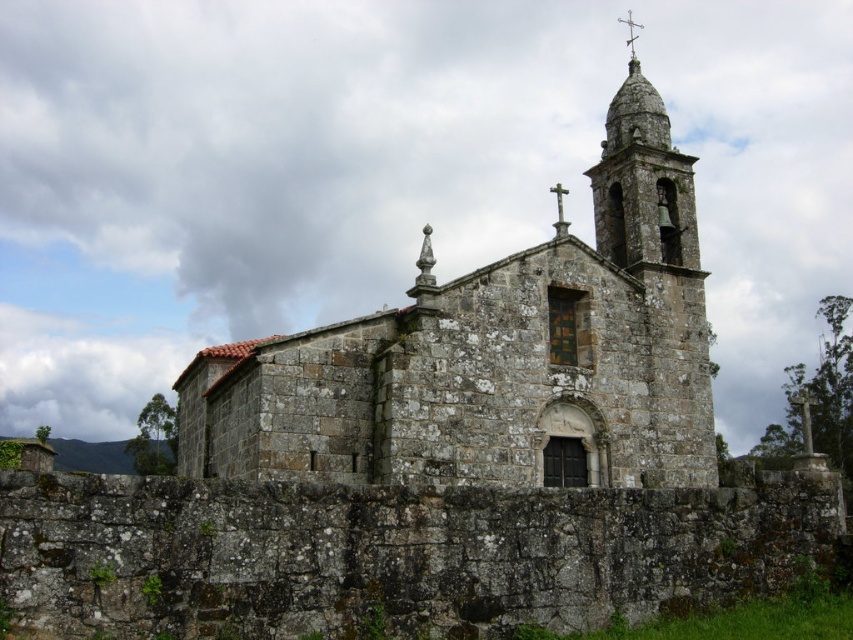
Based on the photo, you are standing at the center of a square in front of the rustic stone church at center. If you walk 10 meters straight ahead, will you hit the church wall?

The position of rustic stone church at center is at point [496,355], so walking 10 meters straight ahead from the center of the square would likely lead you away from the church, not towards its walls. Therefore, you would not hit the church wall.

You are a drone operator tasked with capturing aerial footage of the rustic stone church at center and the metallic cross at upper center. Your drone has a maximum camera zoom range of 25 meters. Can you capture both objects in a single shot without moving the drone?

The rustic stone church at center and metallic cross at upper center are 29.00 meters apart from each other. Since the drone camera can only zoom up to 25 meters, it cannot capture both objects in a single shot without moving the drone.